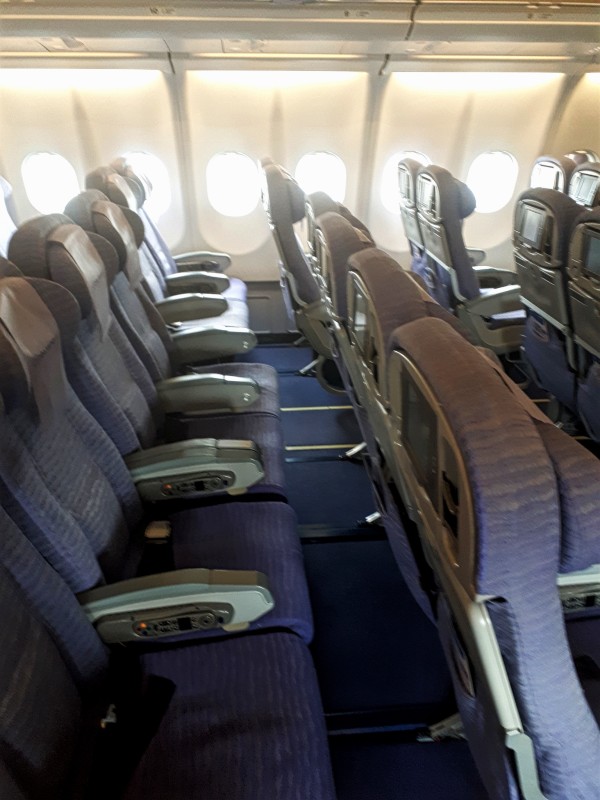
The height and width of the screenshot is (800, 600). Identify the location of arm rest. (179, 616), (206, 477), (221, 410), (221, 350), (199, 304), (206, 282), (213, 266), (499, 306), (486, 272), (475, 256).